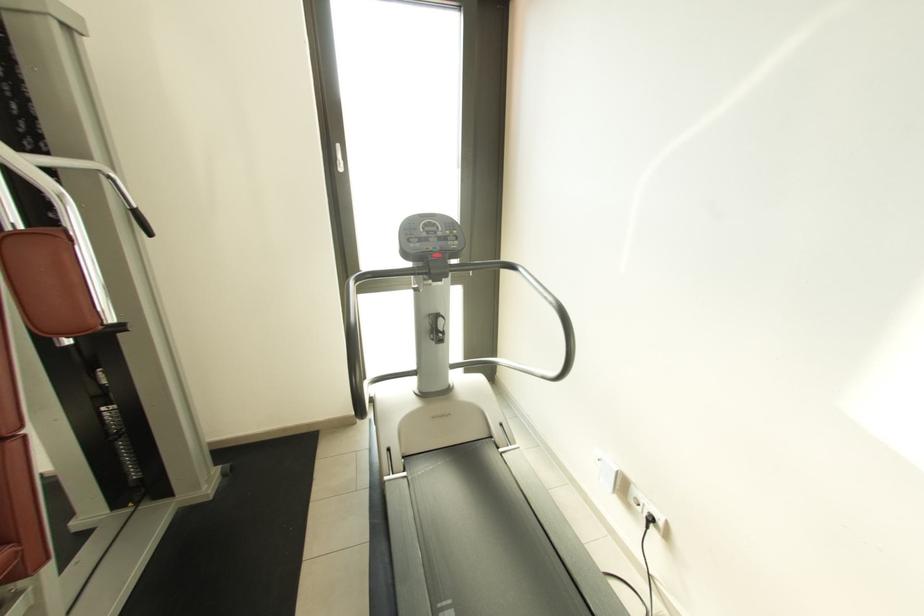
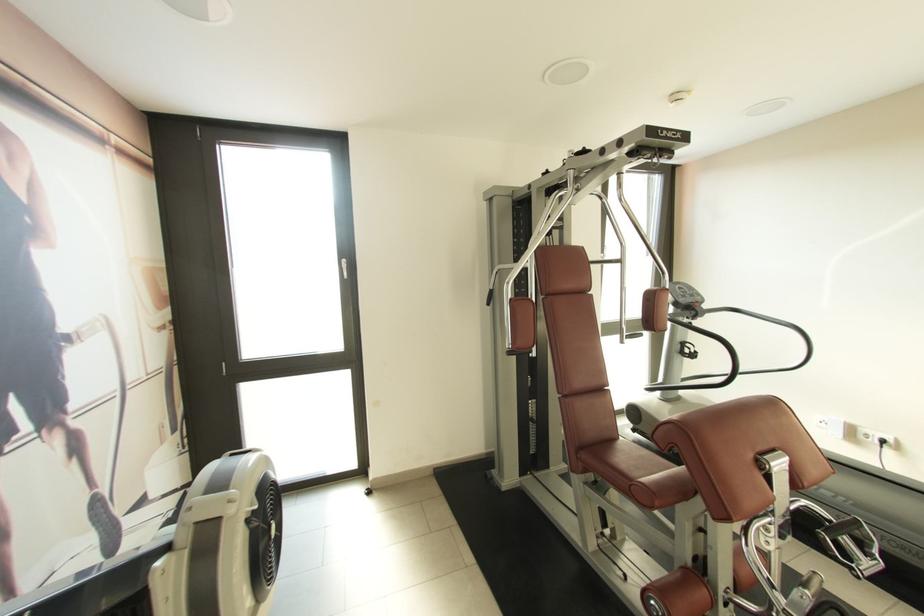
In the second image, find the point that corresponds to pixel 650 516 in the first image.

(882, 440)